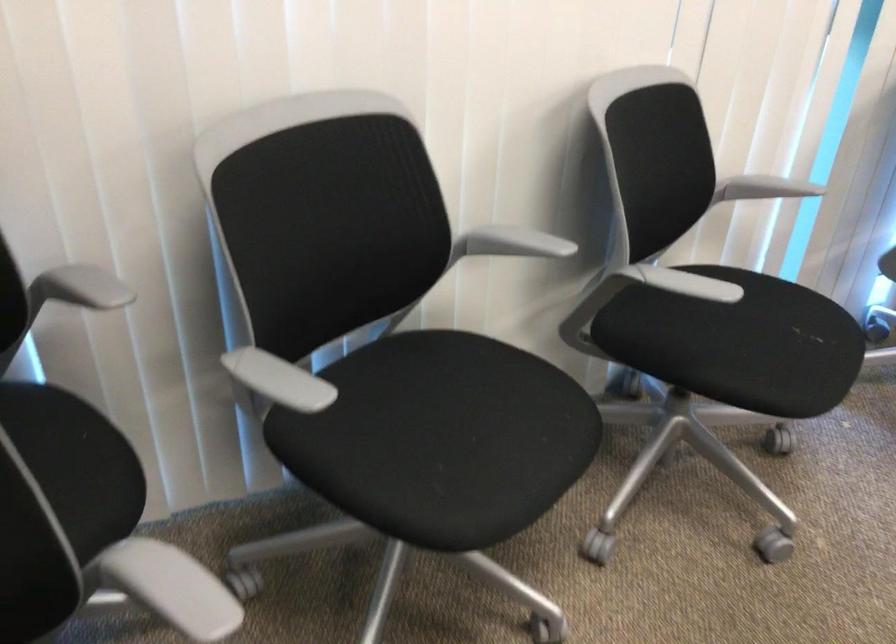
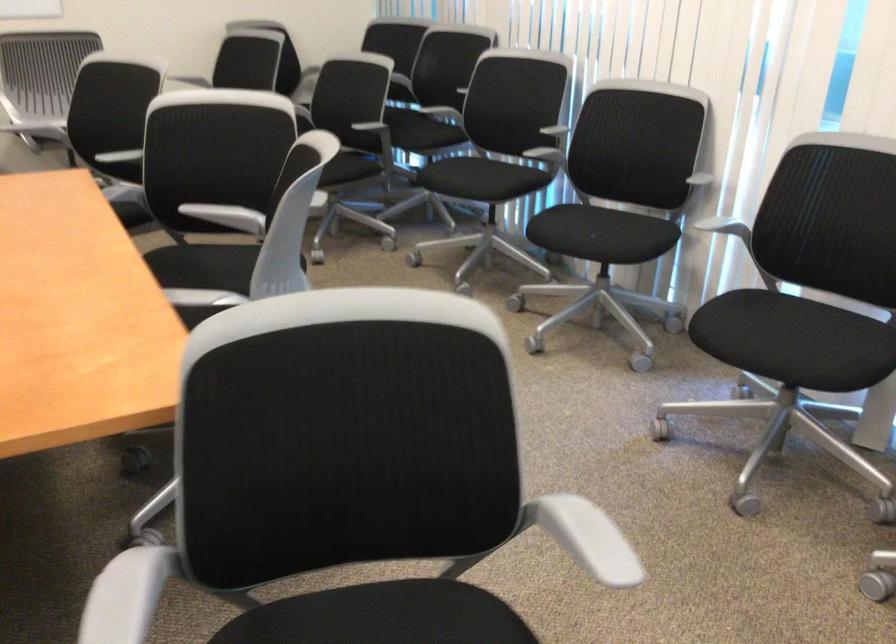
In the second image, find the point that corresponds to (x=790, y=337) in the first image.

(582, 232)